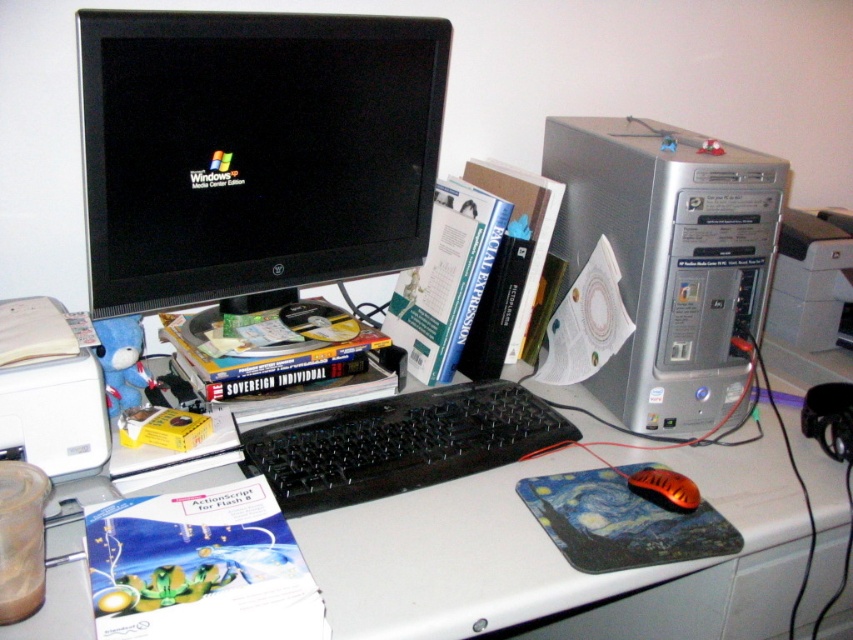
Can you confirm if black glossy monitor at upper left is bigger than silver metallic printer at right?

Indeed, black glossy monitor at upper left has a larger size compared to silver metallic printer at right.

Measure the distance between black glossy monitor at upper left and silver metallic printer at right.

They are 30.03 inches apart.

Is point (117, 310) positioned behind point (828, 321)?

No, it is not.

Identify the location of black glossy monitor at upper left. The height and width of the screenshot is (640, 853). (254, 150).

Does white plastic computer desk at center appear under silver metallic desktop pc at right?

Yes.

Does white plastic computer desk at center have a smaller size compared to silver metallic desktop pc at right?

No.

What do you see at coordinates (453, 561) in the screenshot? This screenshot has height=640, width=853. I see `white plastic computer desk at center` at bounding box center [453, 561].

At what (x,y) coordinates should I click in order to perform the action: click on white plastic computer desk at center. Please return your answer as a coordinate pair (x, y). Image resolution: width=853 pixels, height=640 pixels. Looking at the image, I should click on (453, 561).

Is black glossy monitor at upper left below white plastic computer desk at center?

Actually, black glossy monitor at upper left is above white plastic computer desk at center.

Is point (189, 140) farther from viewer compared to point (734, 461)?

No, it is not.

Does point (344, 202) come closer to viewer compared to point (451, 628)?

No, it is not.

This screenshot has height=640, width=853. I want to click on black glossy monitor at upper left, so click(254, 150).